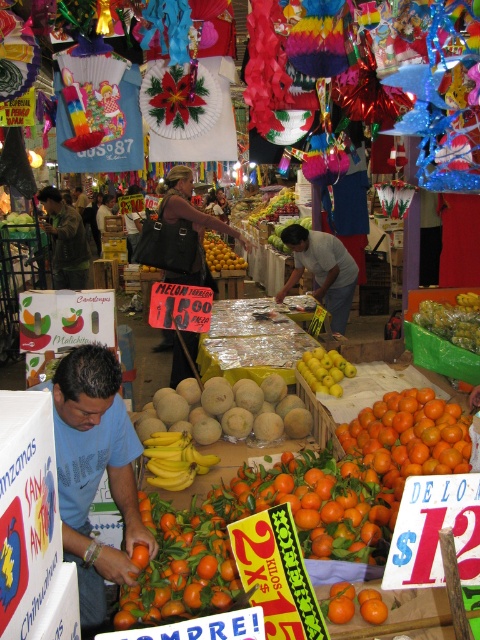
Question: Does blue t-shirt at lower left have a smaller size compared to green matte melon at center?

Choices:
 (A) no
 (B) yes

Answer: (A)

Question: Can you confirm if white cotton shirt at center is positioned below green matte melon at center?

Choices:
 (A) yes
 (B) no

Answer: (B)

Question: Which of the following is the closest to the observer?

Choices:
 (A) (315, 355)
 (B) (179, 193)
 (C) (60, 243)
 (D) (69, 496)

Answer: (D)

Question: Which of the following is the farthest from the observer?

Choices:
 (A) (330, 368)
 (B) (70, 211)
 (C) (78, 388)

Answer: (B)

Question: Does black leather handbag at center appear on the right side of yellow matte lemons at center?

Choices:
 (A) no
 (B) yes

Answer: (A)

Question: Which point is closer to the camera?

Choices:
 (A) (179, 280)
 (B) (328, 384)
 (C) (143, 563)
 (D) (134, 540)

Answer: (C)